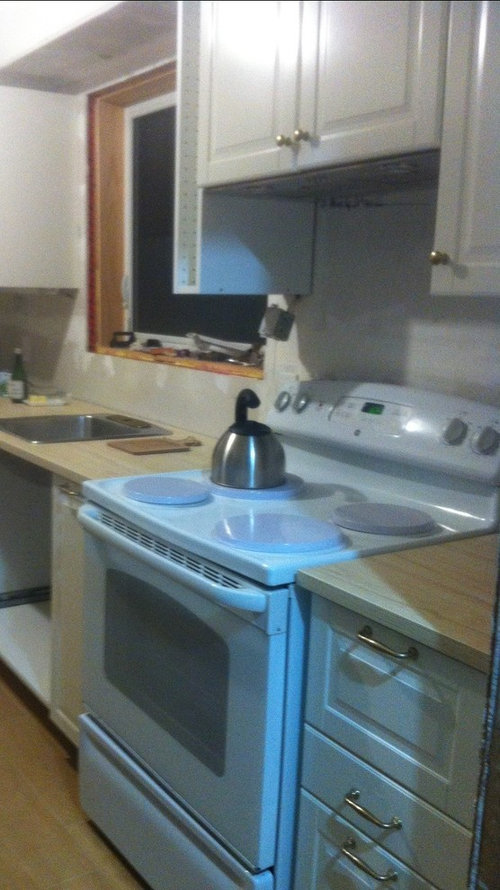
Identify the location of window frame. This screenshot has width=500, height=890. (102, 263).